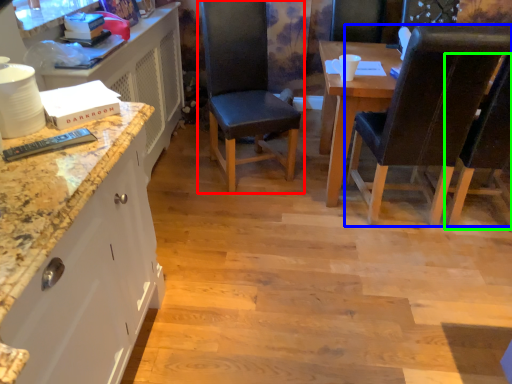
Question: Estimate the real-world distances between objects in this image. Which object is closer to chair (highlighted by a red box), chair (highlighted by a blue box) or chair (highlighted by a green box)?

Choices:
 (A) chair
 (B) chair

Answer: (A)